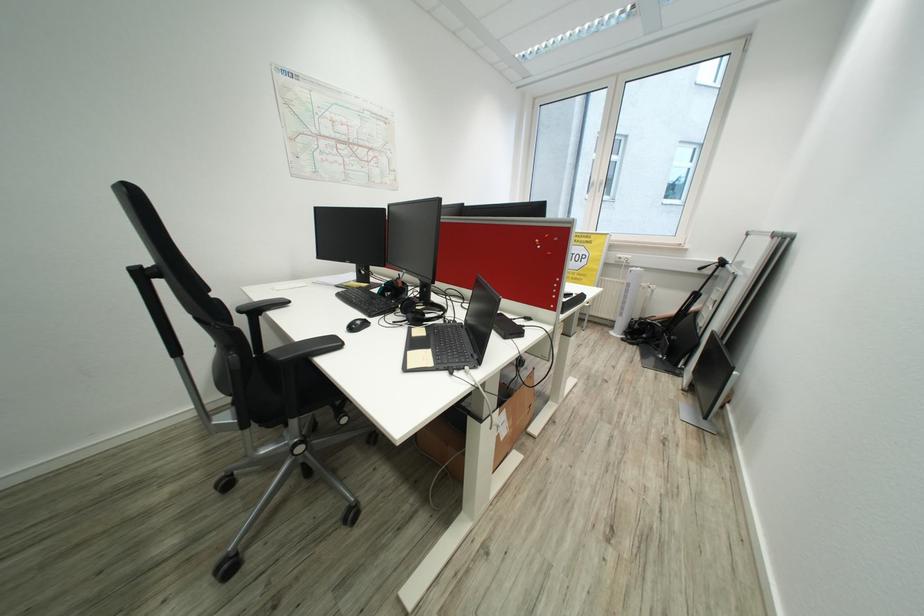
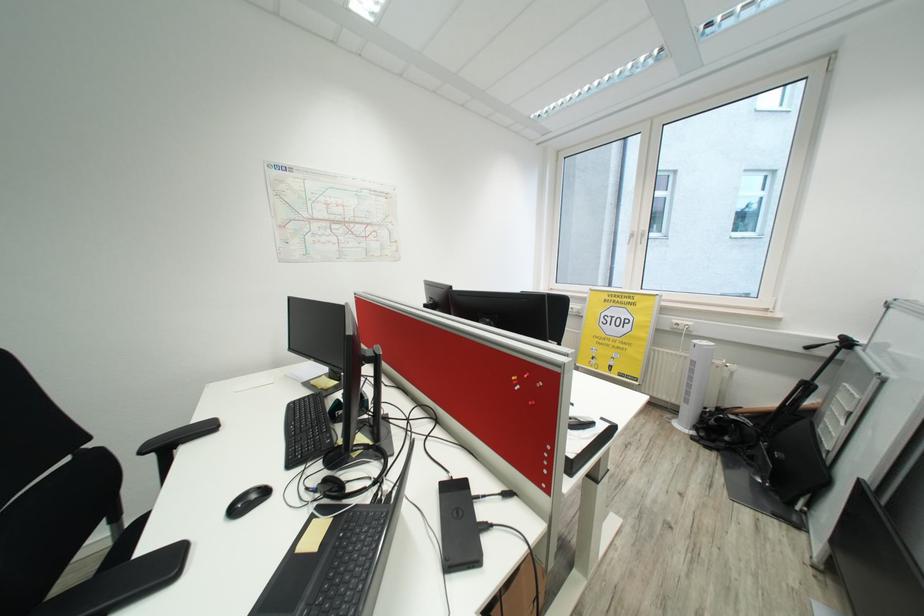
Question: The camera is either moving clockwise (left) or counter-clockwise (right) around the object. The first image is from the beginning of the video and the second image is from the end. Is the camera moving left or right when shooting the video?

Choices:
 (A) Left
 (B) Right

Answer: (B)